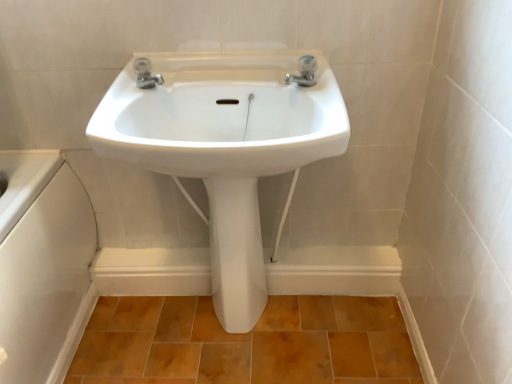
Locate an element on the screen. This screenshot has width=512, height=384. vacant position to the left of silver metallic tap at upper center, which is the second tap from left to right is located at coordinates (229, 76).